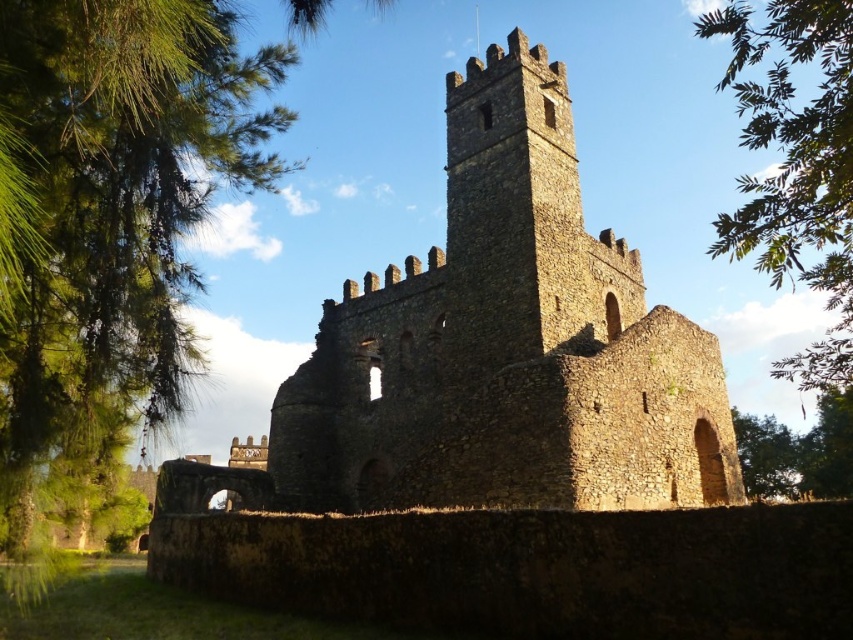
You are a drone operator tasked with flying a drone between the two green leafy trees. The drone has a maximum flight distance of 60 feet. Can the drone safely fly between the green leafy tree at upper right and the green leafy tree at lower right without exceeding its range?

The distance between the green leafy tree at upper right and the green leafy tree at lower right is 62.58 feet, which exceeds the drone operator drone maximum flight distance of 60 feet. The drone cannot safely fly between them without exceeding its range.

You are an architect evaluating the structural integrity of the brown stone tower at center and the green leafy tree at upper right. Which object is shorter?

The brown stone tower at center is shorter than the green leafy tree at upper right.